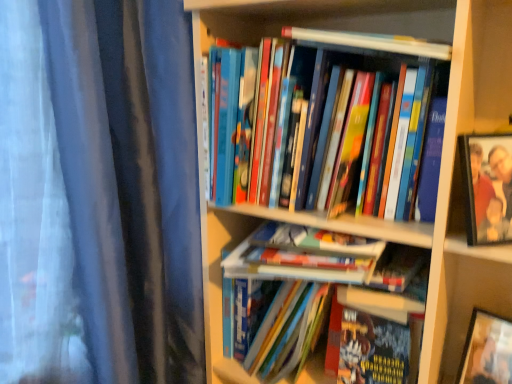
Describe the element at coordinates (371, 42) in the screenshot. The image size is (512, 384). I see `hardcover book at upper center, which appears as the 1th book when viewed from the top` at that location.

The image size is (512, 384). Describe the element at coordinates (326, 257) in the screenshot. I see `hardcover book at center, the 4th book positioned from the bottom` at that location.

Measure the distance between hardcover book at center, placed as the fifth book when sorted from top to bottom, and camera.

hardcover book at center, placed as the fifth book when sorted from top to bottom, is 30.16 inches from camera.

In order to face wooden bookshelf at center, should I rotate leftwards or rightwards?

You should look right and rotate roughly 9.247 degrees.

I want to click on hardcover book at center, the 6th book from the top, so click(370, 317).

This screenshot has width=512, height=384. I want to click on hardcover book at upper center, which appears as the 1th book when viewed from the top, so click(371, 42).

Considering the positions of objects metallic silver photo frame at upper right and hardcover book at center, the 6th book from the top, in the image provided, who is more to the right, metallic silver photo frame at upper right or hardcover book at center, the 6th book from the top,?

From the viewer's perspective, metallic silver photo frame at upper right appears more on the right side.

Can you confirm if metallic silver photo frame at upper right is wider than hardcover book at center, the 1th book in the bottom-to-top sequence?

No, metallic silver photo frame at upper right is not wider than hardcover book at center, the 1th book in the bottom-to-top sequence.

Would you consider metallic silver photo frame at upper right to be distant from hardcover book at center, the 6th book from the top?

No, there isn't a large distance between metallic silver photo frame at upper right and hardcover book at center, the 6th book from the top.

Which point is more forward, (474, 235) or (417, 353)?

Point (474, 235)

Considering the relative positions of hardcover book at center, the 1th book in the bottom-to-top sequence, and hardcover book at center, the 4th book positioned from the bottom, in the image provided, is hardcover book at center, the 1th book in the bottom-to-top sequence, to the right of hardcover book at center, the 4th book positioned from the bottom, from the viewer's perspective?

Correct, you'll find hardcover book at center, the 1th book in the bottom-to-top sequence, to the right of hardcover book at center, the 4th book positioned from the bottom.

Considering the sizes of objects hardcover book at center, the 6th book from the top, and hardcover book at center, the 3th book from the top, in the image provided, who is thinner, hardcover book at center, the 6th book from the top, or hardcover book at center, the 3th book from the top,?

With smaller width is hardcover book at center, the 6th book from the top.

Between hardcover book at center, the 6th book from the top, and hardcover book at center, the 3th book from the top, which one is positioned in front?

hardcover book at center, the 3th book from the top, is more forward.

From the image's perspective, is metallic silver photo frame at upper right on hardcover books at center, which is the 2th book in top-to-bottom order?

Actually, metallic silver photo frame at upper right appears below hardcover books at center, which is the 2th book in top-to-bottom order, in the image.

Which is more to the right, metallic silver photo frame at upper right or hardcover books at center, which is the 2th book in top-to-bottom order?

metallic silver photo frame at upper right.

Is point (486, 162) in front of point (401, 208)?

Yes.

Is metallic silver photo frame at upper right behind hardcover books at center, acting as the 5th book starting from the bottom?

Yes, the depth of metallic silver photo frame at upper right is greater than that of hardcover books at center, acting as the 5th book starting from the bottom.

Considering the relative positions of metallic silver photo frame at upper right and hardcover book at upper center, which appears as the 1th book when viewed from the top, in the image provided, is metallic silver photo frame at upper right to the left or to the right of hardcover book at upper center, which appears as the 1th book when viewed from the top,?

metallic silver photo frame at upper right is to the right of hardcover book at upper center, which appears as the 1th book when viewed from the top.

Is hardcover book at upper center, which appears as the 1th book when viewed from the top, a part of metallic silver photo frame at upper right?

No, hardcover book at upper center, which appears as the 1th book when viewed from the top, is located outside of metallic silver photo frame at upper right.

Is metallic silver photo frame at upper right in front of hardcover book at upper center, which appears as the 1th book when viewed from the top?

That is False.

Between metallic silver photo frame at upper right and hardcover book at upper center, the sixth book positioned from the bottom, which one has larger width?

Wider between the two is hardcover book at upper center, the sixth book positioned from the bottom.

Which of these two, hardcover book at center, placed as the fifth book when sorted from top to bottom, or wooden bookshelf at center, stands taller?

wooden bookshelf at center is taller.

Would you consider hardcover book at center, which is the 2th book in bottom-to-top order, to be distant from wooden bookshelf at center?

Actually, hardcover book at center, which is the 2th book in bottom-to-top order, and wooden bookshelf at center are a little close together.

Looking at this image, is hardcover book at center, placed as the fifth book when sorted from top to bottom, facing towards wooden bookshelf at center?

Yes, hardcover book at center, placed as the fifth book when sorted from top to bottom, is oriented towards wooden bookshelf at center.

How distant is hardcover book at center, which is the 2th book in bottom-to-top order, from wooden bookshelf at center?

hardcover book at center, which is the 2th book in bottom-to-top order, and wooden bookshelf at center are 10.26 inches apart from each other.

From a real-world perspective, does hardcover book at upper center, the sixth book positioned from the bottom, sit lower than wooden bookshelf at center?

Actually, hardcover book at upper center, the sixth book positioned from the bottom, is physically above wooden bookshelf at center in the real world.

Can you tell me how much hardcover book at upper center, the sixth book positioned from the bottom, and wooden bookshelf at center differ in facing direction?

They differ by 1.48 degrees in their facing directions.

Relative to wooden bookshelf at center, is hardcover book at upper center, which appears as the 1th book when viewed from the top, in front or behind?

Clearly, hardcover book at upper center, which appears as the 1th book when viewed from the top, is behind wooden bookshelf at center.

Can you confirm if hardcover book at upper center, the sixth book positioned from the bottom, is taller than wooden bookshelf at center?

In fact, hardcover book at upper center, the sixth book positioned from the bottom, may be shorter than wooden bookshelf at center.

Is hardcover book at center, the 3th book from the top, facing towards hardcover book at upper center, the sixth book positioned from the bottom?

No, hardcover book at center, the 3th book from the top, is not facing towards hardcover book at upper center, the sixth book positioned from the bottom.

Is hardcover book at center, the 3th book from the top, closer to camera compared to hardcover book at upper center, the sixth book positioned from the bottom?

No, it is behind hardcover book at upper center, the sixth book positioned from the bottom.

Which is more to the right, hardcover book at center, the 4th book positioned from the bottom, or hardcover book at upper center, which appears as the 1th book when viewed from the top?

Positioned to the right is hardcover book at upper center, which appears as the 1th book when viewed from the top.

Which is less distant, (262, 268) or (423, 51)?

Positioned in front is point (423, 51).

The height and width of the screenshot is (384, 512). I want to click on picture frame positioned vertically above the hardcover book at center, the 6th book from the top (from a real-world perspective), so click(487, 187).

The height and width of the screenshot is (384, 512). What are the coordinates of `the 4th book to the left of the hardcover book at center, the 1th book in the bottom-to-top sequence, starting your count from the anchor` in the screenshot? It's located at (326, 257).

Considering their positions, is hardcover book at center, placed as the fifth book when sorted from top to bottom, positioned closer to hardcover book at center, the 3th book from the top, than wooden bookshelf at center?

hardcover book at center, placed as the fifth book when sorted from top to bottom, lies closer to hardcover book at center, the 3th book from the top, than the other object.

When comparing their distances from metallic silver photo frame at upper right, does hardcover books at center, which is the 2th book in top-to-bottom order, or hardcover book at center, placed as the fifth book when sorted from top to bottom, seem further?

hardcover book at center, placed as the fifth book when sorted from top to bottom.

From the image, which object appears to be nearer to hardcover book at center, the 4th book positioned from the bottom, wooden bookshelf at center or hardcover books at center, acting as the 5th book starting from the bottom?

wooden bookshelf at center is positioned closer to the anchor hardcover book at center, the 4th book positioned from the bottom.

Based on their spatial positions, is hardcover book at center, which is the 2th book in bottom-to-top order, or hardcover books at center, which is the 2th book in top-to-bottom order, further from hardcover book at center, the 6th book from the top?

hardcover books at center, which is the 2th book in top-to-bottom order, lies further to hardcover book at center, the 6th book from the top, than the other object.

From the image, which object appears to be farther from hardcover book at upper center, which appears as the 1th book when viewed from the top, hardcover book at center, the 1th book in the bottom-to-top sequence, or hardcover books at center, which is the 2th book in top-to-bottom order?

hardcover book at center, the 1th book in the bottom-to-top sequence.

Which object lies nearer to the anchor point metallic silver photo frame at upper right, hardcover book at center, the 6th book from the top, or hardcover books at center, acting as the 5th book starting from the bottom?

hardcover books at center, acting as the 5th book starting from the bottom, is closer to metallic silver photo frame at upper right.

Looking at the image, which one is located closer to hardcover book at center, which is the 2th book in bottom-to-top order, hardcover book at center, the 6th book from the top, or metallic silver photo frame at upper right?

hardcover book at center, the 6th book from the top, lies closer to hardcover book at center, which is the 2th book in bottom-to-top order, than the other object.

From the image, which object appears to be farther from metallic silver photo frame at upper right, hardcover books at center, which is the 2th book in top-to-bottom order, or hardcover book at center, the 6th book from the top?

The object further to metallic silver photo frame at upper right is hardcover book at center, the 6th book from the top.

I want to click on book between hardcover books at center, acting as the 5th book starting from the bottom, and hardcover books at center, which ranks as the 3th book in bottom-to-top order, in the up-down direction, so click(x=326, y=257).

Find the location of a particular element. picture frame between wooden bookshelf at center and hardcover book at center, the 6th book from the top, from front to back is located at coordinates (487, 187).

Where is `picture frame between wooden bookshelf at center and hardcover book at center, the 3th book from the top, in the front-back direction`? The height and width of the screenshot is (384, 512). picture frame between wooden bookshelf at center and hardcover book at center, the 3th book from the top, in the front-back direction is located at coordinates (487, 187).

In order to click on picture frame between hardcover books at center, acting as the 5th book starting from the bottom, and hardcover book at center, which is the 2th book in bottom-to-top order, vertically in this screenshot , I will do `click(487, 187)`.